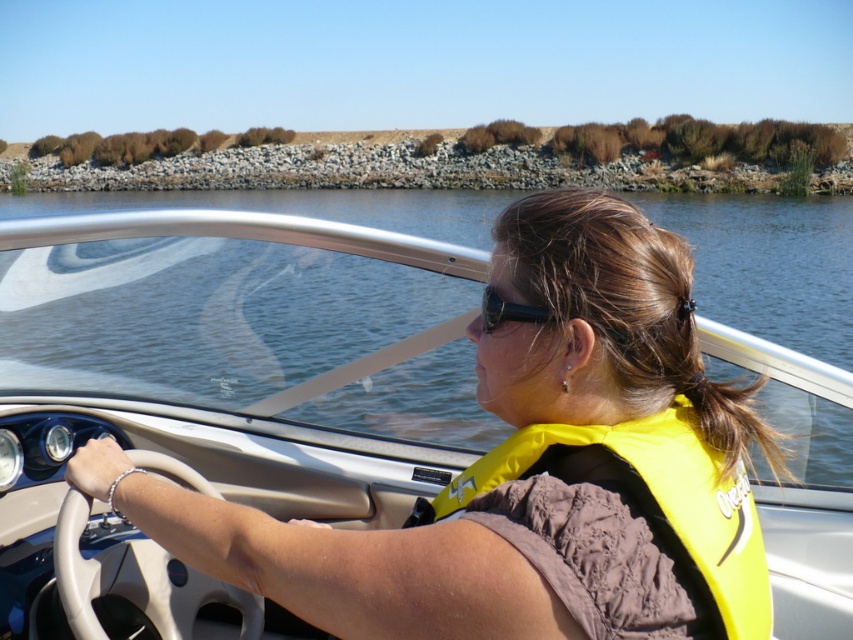
Can you confirm if white leather steering wheel at center is positioned below black plastic sunglasses at upper center?

Indeed, white leather steering wheel at center is positioned under black plastic sunglasses at upper center.

Does white leather steering wheel at center have a lesser width compared to black plastic sunglasses at upper center?

No.

Is point (247, 609) more distant than point (483, 305)?

That is True.

Find the location of `white leather steering wheel at center`. white leather steering wheel at center is located at coordinates (136, 580).

Is point (212, 580) closer to camera compared to point (123, 586)?

No, (212, 580) is behind (123, 586).

Does matte white steering wheel at center have a greater width compared to white leather steering wheel at center?

Yes, matte white steering wheel at center is wider than white leather steering wheel at center.

Between point (216, 568) and point (103, 568), which one is positioned in front?

Positioned in front is point (216, 568).

Locate an element on the screen. matte white steering wheel at center is located at coordinates (363, 433).

Which is above, matte white steering wheel at center or yellow fabric life vest at center?

yellow fabric life vest at center

Is matte white steering wheel at center thinner than yellow fabric life vest at center?

No.

Find the location of a particular element. The image size is (853, 640). matte white steering wheel at center is located at coordinates (363, 433).